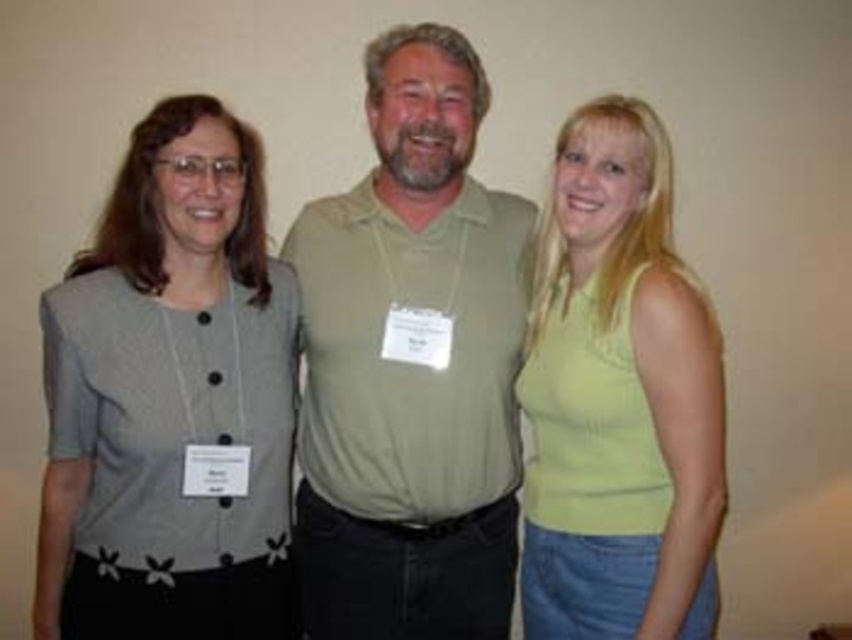
Question: Can you confirm if green cotton polo shirt at center is positioned below gray fabric blouse at left?

Choices:
 (A) no
 (B) yes

Answer: (A)

Question: Estimate the real-world distances between objects in this image. Which object is farther from the gray fabric blouse at left?

Choices:
 (A) green cotton polo shirt at center
 (B) lime green sleeveless top at right

Answer: (B)

Question: Where is gray fabric blouse at left located in relation to lime green sleeveless top at right in the image?

Choices:
 (A) left
 (B) right

Answer: (A)

Question: Which point appears closest to the camera in this image?

Choices:
 (A) (620, 401)
 (B) (142, 561)
 (C) (435, 435)

Answer: (B)

Question: Which point is closer to the camera?

Choices:
 (A) lime green sleeveless top at right
 (B) green cotton polo shirt at center

Answer: (A)

Question: Is green cotton polo shirt at center thinner than gray fabric blouse at left?

Choices:
 (A) yes
 (B) no

Answer: (B)